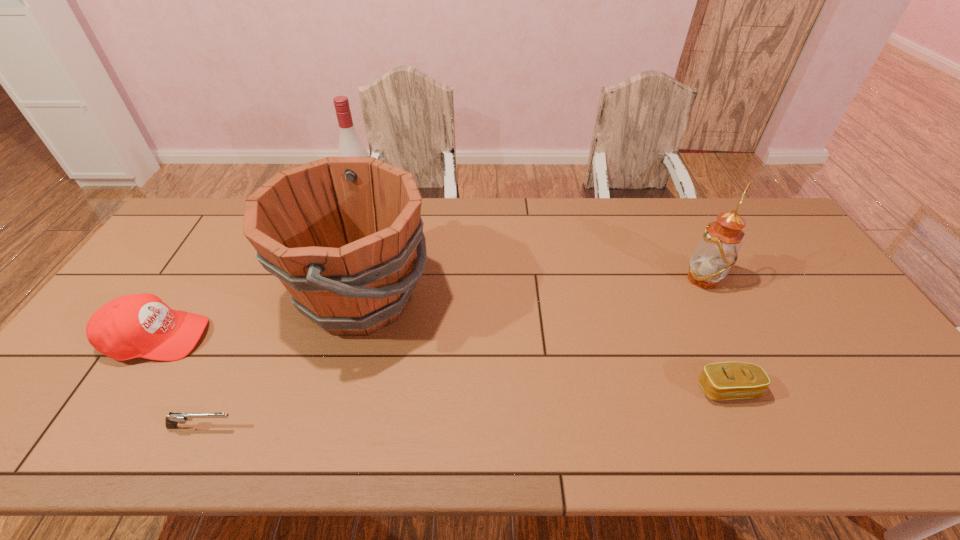
Find the location of `vacant space located 0.250m on the front panel of the baseball cap`. vacant space located 0.250m on the front panel of the baseball cap is located at coordinates (300, 338).

Identify the location of vacant space located on the zipper side of the second nearest object. (744, 425).

Image resolution: width=960 pixels, height=540 pixels. Identify the location of vacant area situated 0.100m on the front-facing side of the nearest object. (281, 427).

Where is `object present at the far edge`? object present at the far edge is located at coordinates (350, 145).

Where is `object present at the near edge`? Image resolution: width=960 pixels, height=540 pixels. object present at the near edge is located at coordinates (171, 422).

Identify the location of object that is at the left edge. (141, 325).

This screenshot has width=960, height=540. I want to click on free space at the far edge, so click(x=536, y=198).

The height and width of the screenshot is (540, 960). Identify the location of vacant region at the near edge of the desktop. (719, 431).

In the image, there is a desktop. Identify the location of free region at the right edge. The height and width of the screenshot is (540, 960). click(x=751, y=246).

Find the location of a particular element. vacant space at the far left corner of the desktop is located at coordinates (204, 208).